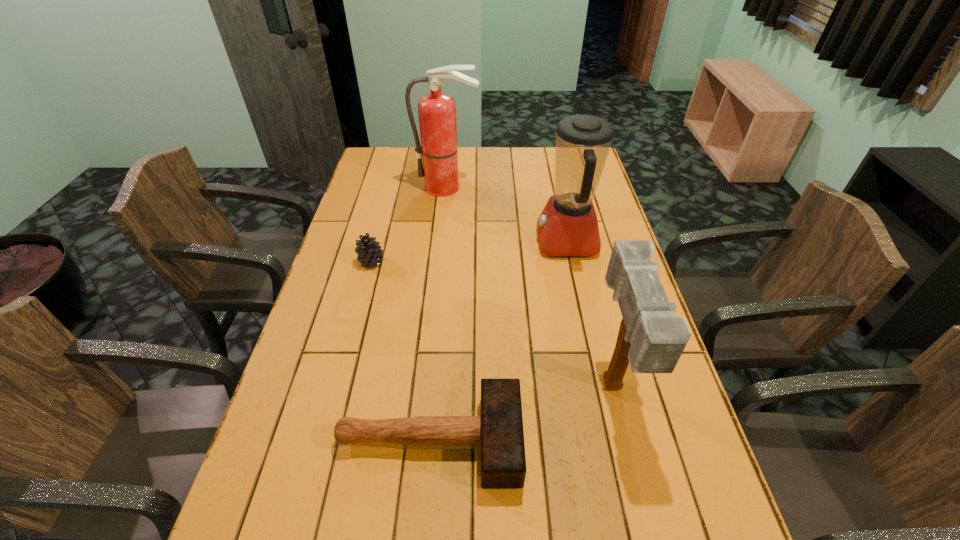
You are a GUI agent. You are given a task and a screenshot of the screen. Output one action in this format:
    pyautogui.click(x=<x>, y=<y>)
    Task: Click on the free space at the right edge of the desktop
    The image size is (960, 540).
    Given the screenshot: What is the action you would take?
    pyautogui.click(x=670, y=448)

You are a GUI agent. You are given a task and a screenshot of the screen. Output one action in this format:
    pyautogui.click(x=<x>, y=<y>)
    Task: Click on the free region at the far right corner
    This screenshot has width=960, height=540.
    Given the screenshot: What is the action you would take?
    pyautogui.click(x=551, y=151)

Where is `free area in between the farthest object and the shorter mallet`? The width and height of the screenshot is (960, 540). free area in between the farthest object and the shorter mallet is located at coordinates tap(439, 314).

This screenshot has height=540, width=960. In order to click on vacant area between the left mallet and the second shortest object in this screenshot , I will do `click(400, 351)`.

Find the location of `free space between the shortest object and the fourth tallest object`. free space between the shortest object and the fourth tallest object is located at coordinates (400, 351).

Identify the location of vacant point located between the fourth tallest object and the blender. (468, 252).

Where is `free space between the right mallet and the blender`? Image resolution: width=960 pixels, height=540 pixels. free space between the right mallet and the blender is located at coordinates (589, 314).

Identify the location of free space between the farthest object and the blender. The height and width of the screenshot is (540, 960). (507, 214).

The image size is (960, 540). Identify the location of free area in between the shortest object and the blender. pyautogui.click(x=498, y=341).

The height and width of the screenshot is (540, 960). I want to click on free spot between the third tallest object and the second shortest object, so click(492, 325).